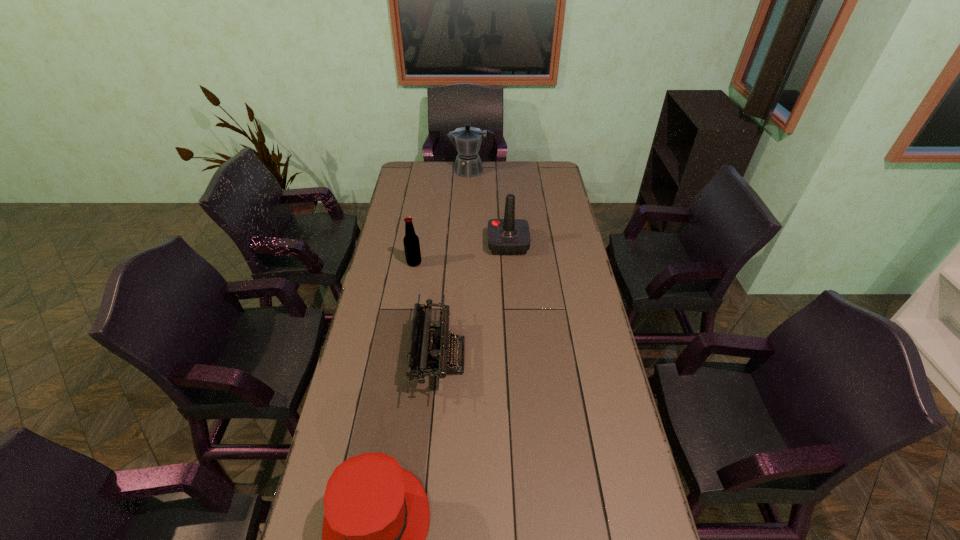
The width and height of the screenshot is (960, 540). Identify the location of vacant area located 0.170m on the typing side of the second nearest object. (517, 357).

You are a GUI agent. You are given a task and a screenshot of the screen. Output one action in this format:
    pyautogui.click(x=<x>, y=<y>)
    Task: Click on the object that is at the far edge
    
    Given the screenshot: What is the action you would take?
    pyautogui.click(x=467, y=140)

Find the location of `object that is positioned at the left edge`. object that is positioned at the left edge is located at coordinates (411, 241).

You are a GUI agent. You are given a task and a screenshot of the screen. Output one action in this format:
    pyautogui.click(x=<x>, y=<y>)
    Task: Click on the vacant space at the far edge of the desktop
    The height and width of the screenshot is (540, 960).
    Given the screenshot: What is the action you would take?
    pyautogui.click(x=512, y=168)

You are a GUI agent. You are given a task and a screenshot of the screen. Output one action in this format:
    pyautogui.click(x=<x>, y=<y>)
    Task: Click on the free space at the left edge of the desktop
    
    Given the screenshot: What is the action you would take?
    pyautogui.click(x=398, y=270)

In the image, there is a desktop. Find the location of `vacant area at the right edge`. vacant area at the right edge is located at coordinates (538, 200).

You are a GUI agent. You are given a task and a screenshot of the screen. Output one action in this format:
    pyautogui.click(x=<x>, y=<y>)
    Task: Click on the vacant area at the far left corner
    This screenshot has width=960, height=540.
    Given the screenshot: What is the action you would take?
    pyautogui.click(x=418, y=173)

I want to click on empty space between the second nearest object and the coffeepot, so click(x=455, y=264).

This screenshot has height=540, width=960. I want to click on free space between the joystick and the fourth farthest object, so click(473, 301).

I want to click on vacant space that's between the beer bottle and the fourth nearest object, so click(461, 254).